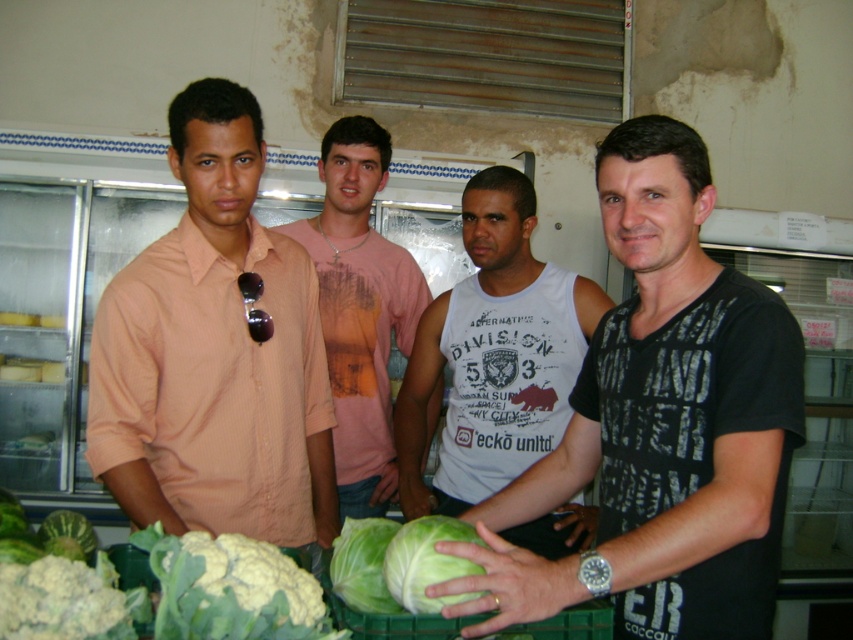
Question: Which point is closer to the camera?

Choices:
 (A) (73, 512)
 (B) (9, 621)

Answer: (B)

Question: Can you confirm if matte peach shirt at left is positioned to the left of pink cotton shirt at center?

Choices:
 (A) no
 (B) yes

Answer: (B)

Question: Which object is farther from the camera taking this photo?

Choices:
 (A) green leafy cabbage at lower center
 (B) black printed t-shirt at center
 (C) pink cotton shirt at center
 (D) green matte cabbage at lower left

Answer: (C)

Question: Which object is positioned closest to the matte peach shirt at left?

Choices:
 (A) green leafy cabbage at lower left
 (B) green matte cabbage at center
 (C) pink cotton shirt at center
 (D) green leafy cabbage at lower center

Answer: (A)

Question: In this image, where is green matte cabbage at lower left located relative to green leafy cabbage at lower left?

Choices:
 (A) right
 (B) left

Answer: (A)

Question: Where is green matte cabbage at lower left located in relation to green leafy cabbage at lower left in the image?

Choices:
 (A) above
 (B) below

Answer: (A)